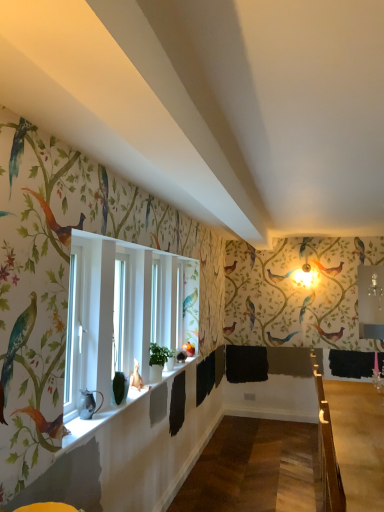
Describe the element at coordinates (327, 449) in the screenshot. Image resolution: width=384 pixels, height=512 pixels. I see `wooden at right` at that location.

This screenshot has height=512, width=384. Find the location of `wooden at right`. wooden at right is located at coordinates (327, 449).

How many degrees apart are the facing directions of matte black pitcher at window and wooden at right?

The facing directions of matte black pitcher at window and wooden at right are 9.24 degrees apart.

Does matte black pitcher at window touch wooden at right?

No, matte black pitcher at window is not with wooden at right.

Does point (98, 410) appear closer or farther from the camera than point (324, 421)?

Point (98, 410) is positioned farther from the camera compared to point (324, 421).

Does matte black pitcher at window have a lesser height compared to wooden at right?

Correct, matte black pitcher at window is not as tall as wooden at right.

Can you confirm if wooden at right is positioned to the right of white glossy window sill at lower center?

Correct, you'll find wooden at right to the right of white glossy window sill at lower center.

Who is shorter, wooden at right or white glossy window sill at lower center?

white glossy window sill at lower center is shorter.

Is wooden at right placed right next to white glossy window sill at lower center?

No, wooden at right is not with white glossy window sill at lower center.

Is wooden at right positioned with its back to white glossy window sill at lower center?

No, white glossy window sill at lower center is not at the back of wooden at right.

From the picture: From the image's perspective, is matte black pitcher at window located above or below white glossy window sill at lower center?

Clearly, from the image's perspective, matte black pitcher at window is above white glossy window sill at lower center.

Is matte black pitcher at window oriented towards white glossy window sill at lower center?

No, matte black pitcher at window does not turn towards white glossy window sill at lower center.

Based on the photo, considering the sizes of matte black pitcher at window and white glossy window sill at lower center in the image, is matte black pitcher at window taller or shorter than white glossy window sill at lower center?

matte black pitcher at window is taller than white glossy window sill at lower center.

From a real-world perspective, who is located lower, matte black pitcher at window or white glossy window sill at lower center?

white glossy window sill at lower center, from a real-world perspective.

Which is more to the left, wooden at right or matte black pitcher at window?

Positioned to the left is matte black pitcher at window.

Is wooden at right shorter than matte black pitcher at window?

No.

In the image, there is a matte black pitcher at window. Find the location of `rail below it (from a real-world perspective)`. rail below it (from a real-world perspective) is located at coordinates (327, 449).

Is wooden at right oriented towards matte black pitcher at window?

No, wooden at right is not oriented towards matte black pitcher at window.

At what (x,y) coordinates should I click in order to perform the action: click on animal above the white glossy window sill at lower center (from the image's perspective). Please return your answer as a coordinate pair (x, y). The height and width of the screenshot is (512, 384). Looking at the image, I should click on (88, 403).

Considering the relative sizes of white glossy window sill at lower center and matte black pitcher at window in the image provided, is white glossy window sill at lower center taller than matte black pitcher at window?

No, white glossy window sill at lower center is not taller than matte black pitcher at window.

Between white glossy window sill at lower center and matte black pitcher at window, which one has smaller width?

Thinner between the two is matte black pitcher at window.

Is there a large distance between white glossy window sill at lower center and matte black pitcher at window?

white glossy window sill at lower center is near matte black pitcher at window, not far away.

Does white glossy window sill at lower center appear on the left side of wooden at right?

Yes, white glossy window sill at lower center is to the left of wooden at right.

From a real-world perspective, between white glossy window sill at lower center and wooden at right, who is vertically higher?

white glossy window sill at lower center.

Looking at this image, is white glossy window sill at lower center positioned with its back to wooden at right?

No, white glossy window sill at lower center is not facing away from wooden at right.

Considering their positions, is white glossy window sill at lower center located in front of or behind wooden at right?

white glossy window sill at lower center is in front of wooden at right.

Where is `animal that appears above the wooden at right (from the image's perspective)`? This screenshot has height=512, width=384. animal that appears above the wooden at right (from the image's perspective) is located at coordinates (88, 403).

Where is `window sill in front of the wooden at right`? The height and width of the screenshot is (512, 384). window sill in front of the wooden at right is located at coordinates (133, 406).

From the picture: Considering their positions, is matte black pitcher at window positioned further to wooden at right than white glossy window sill at lower center?

matte black pitcher at window is further to wooden at right.

Consider the image. Looking at the image, which one is located further to wooden at right, white glossy window sill at lower center or matte black pitcher at window?

matte black pitcher at window.

Estimate the real-world distances between objects in this image. Which object is closer to white glossy window sill at lower center, wooden at right or matte black pitcher at window?

Based on the image, matte black pitcher at window appears to be nearer to white glossy window sill at lower center.

Considering their positions, is white glossy window sill at lower center positioned closer to matte black pitcher at window than wooden at right?

Based on the image, white glossy window sill at lower center appears to be nearer to matte black pitcher at window.

Which object lies nearer to the anchor point matte black pitcher at window, wooden at right or white glossy window sill at lower center?

white glossy window sill at lower center.

Which object lies further to the anchor point white glossy window sill at lower center, matte black pitcher at window or wooden at right?

wooden at right lies further to white glossy window sill at lower center than the other object.

Identify the location of window sill situated between matte black pitcher at window and wooden at right from left to right. This screenshot has width=384, height=512. (133, 406).